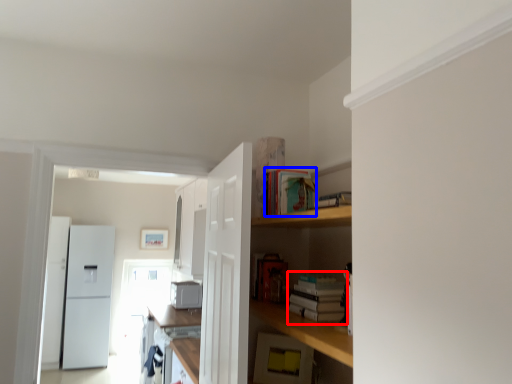
Question: Which object appears closest to the camera in this image, book (highlighted by a red box) or book (highlighted by a blue box)?

Choices:
 (A) book
 (B) book

Answer: (A)